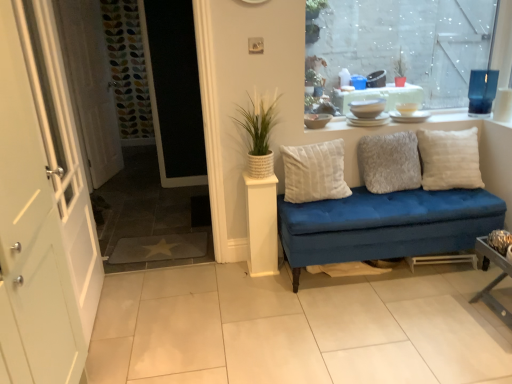
This screenshot has height=384, width=512. I want to click on free space in front of white matte pedestal at center, marked as the first table in a left-to-right arrangement, so click(x=265, y=279).